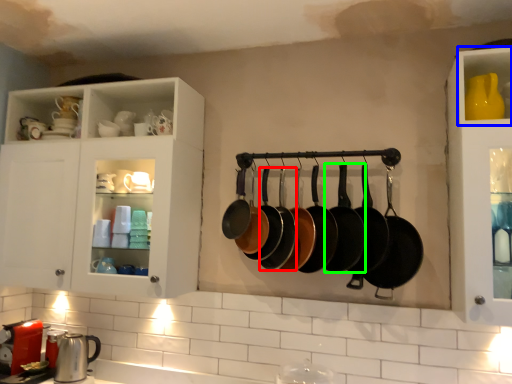
Question: Estimate the real-world distances between objects in this image. Which object is farther from frying pan (highlighted by a red box), cabinet (highlighted by a blue box) or frying pan (highlighted by a green box)?

Choices:
 (A) cabinet
 (B) frying pan

Answer: (A)